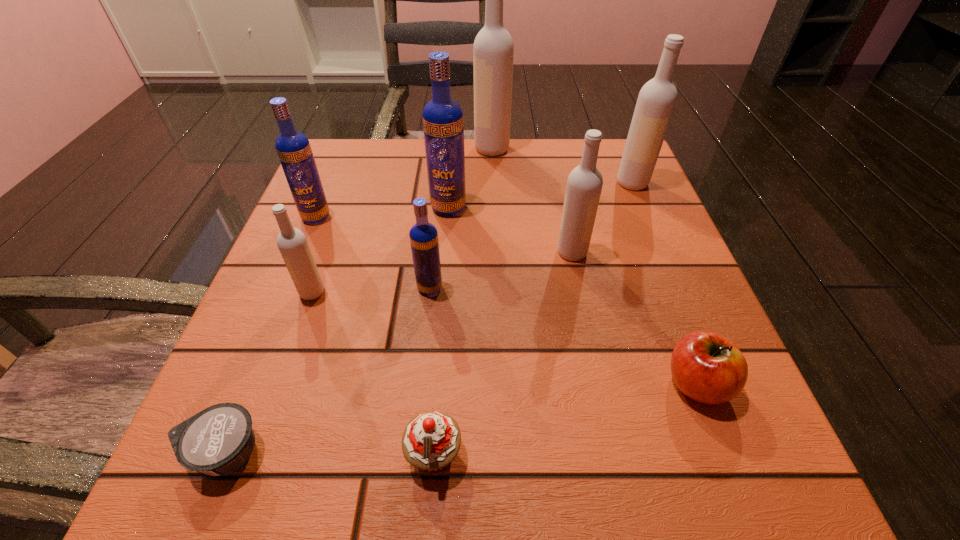
Image resolution: width=960 pixels, height=540 pixels. I want to click on vacant region located 0.280m on the front of the smallest blue vodka, so click(x=410, y=468).

Where is `vacant region located 0.070m on the right of the leftmost white vodka`? vacant region located 0.070m on the right of the leftmost white vodka is located at coordinates (366, 293).

Where is `free space located on the right of the cupcake`? free space located on the right of the cupcake is located at coordinates (701, 455).

Where is `vacant space located 0.080m on the left of the third nearest object`? vacant space located 0.080m on the left of the third nearest object is located at coordinates (609, 383).

Locate an element on the screen. vacant space located 0.120m on the back of the yogurt is located at coordinates (268, 346).

The width and height of the screenshot is (960, 540). In order to click on cupcake at the near edge in this screenshot , I will do `click(431, 440)`.

Where is `yogurt positioned at the near edge`? yogurt positioned at the near edge is located at coordinates (219, 439).

The image size is (960, 540). In order to click on yogurt present at the left edge in this screenshot , I will do `click(219, 439)`.

Image resolution: width=960 pixels, height=540 pixels. What are the coordinates of `vodka located in the right edge section of the desktop` in the screenshot? It's located at (657, 98).

You are a GUI agent. You are given a task and a screenshot of the screen. Output one action in this format:
    pyautogui.click(x=<x>, y=<y>)
    Task: Click on the apple that is positioned at the right edge
    
    Given the screenshot: What is the action you would take?
    click(707, 367)